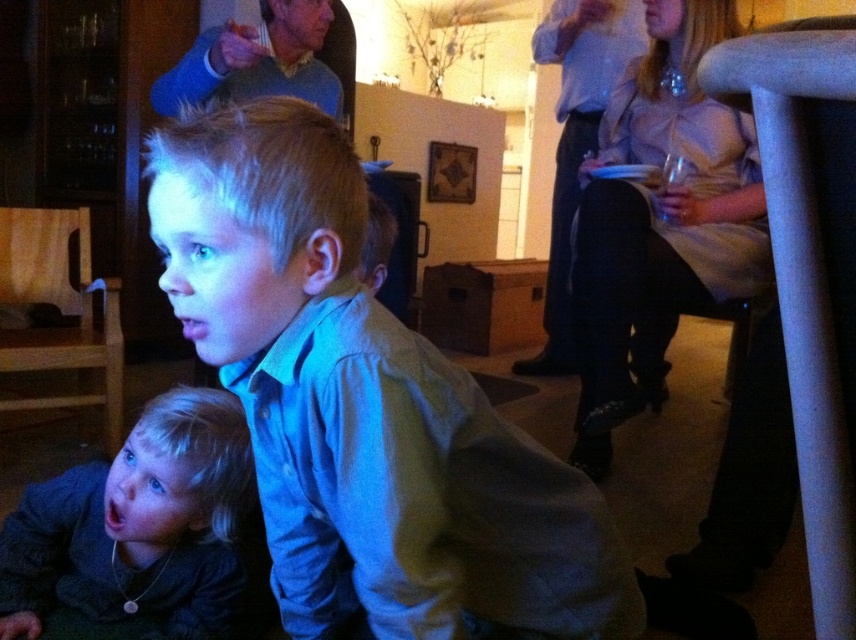
Question: Does light blue shirt at upper right lie behind blue sweater at upper center?

Choices:
 (A) yes
 (B) no

Answer: (A)

Question: Which of the following is the farthest from the observer?

Choices:
 (A) silky beige dress at upper right
 (B) blue sweater at upper center

Answer: (B)

Question: Where is matte blue shirt at center located in relation to dark gray sweater at lower left in the image?

Choices:
 (A) right
 (B) left

Answer: (A)

Question: Which point appears farthest from the camera in this image?

Choices:
 (A) (200, 60)
 (B) (244, 308)
 (C) (572, 356)

Answer: (C)

Question: Is matte blue shirt at center in front of silky beige dress at upper right?

Choices:
 (A) no
 (B) yes

Answer: (B)

Question: Which of the following is the closest to the observer?

Choices:
 (A) silky beige dress at upper right
 (B) light blue shirt at upper right

Answer: (A)